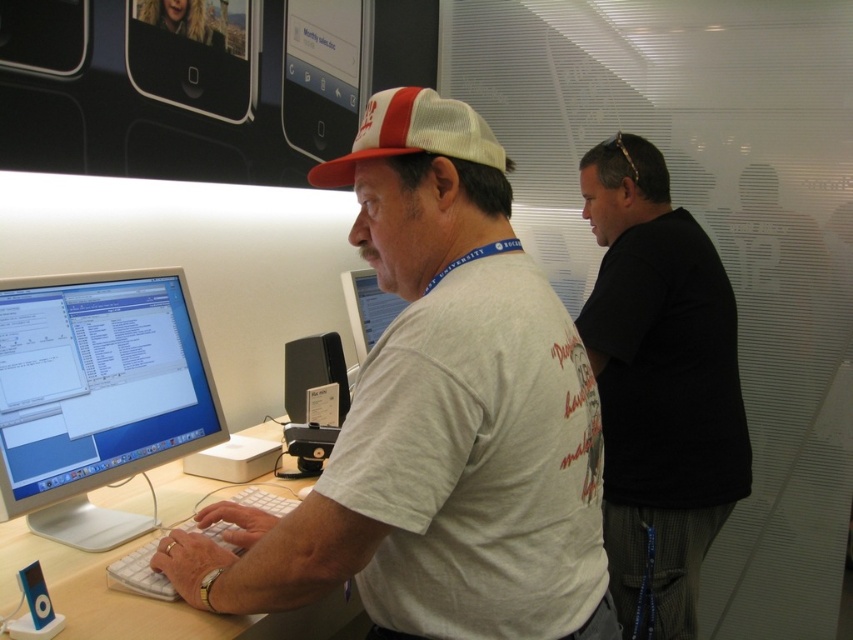
You are a customer in the store and want to see the black plastic speaker at center clearly. However, the black matte shirt at right is blocking your view. Can you move the shirt to get a better look at the speaker?

The black matte shirt at right is positioned over the black plastic speaker at center, so moving the shirt would allow you to see the speaker underneath.

You are a customer in the store and want to see the white mesh baseball cap at center that the employee is wearing. Is the cap visible to you from your current position in front of the white plastic table at center?

The white mesh baseball cap at center is behind the white plastic table at center, so it might not be visible from your current position in front of the white plastic table at center.

You are setting up a desk in an Apple Store. You have a black plastic speaker at center and a matte white monitor at center. Which object should you place first to ensure proper setup?

The black plastic speaker at center is larger in size than the matte white monitor at center, so you should place the black plastic speaker at center first to accommodate its larger size during setup.